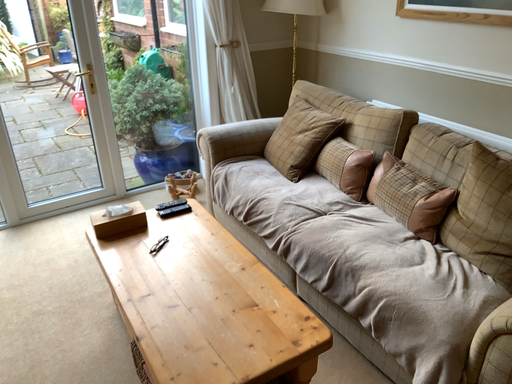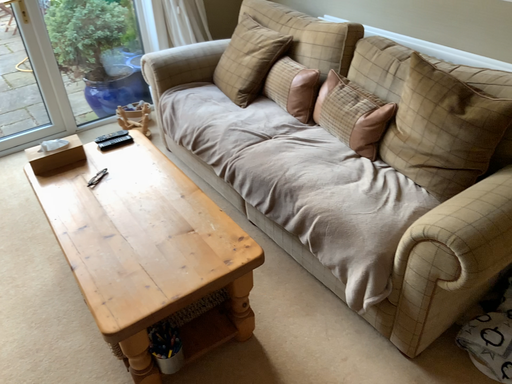
Question: Which way did the camera rotate in the video?

Choices:
 (A) rotated downward
 (B) rotated upward

Answer: (A)